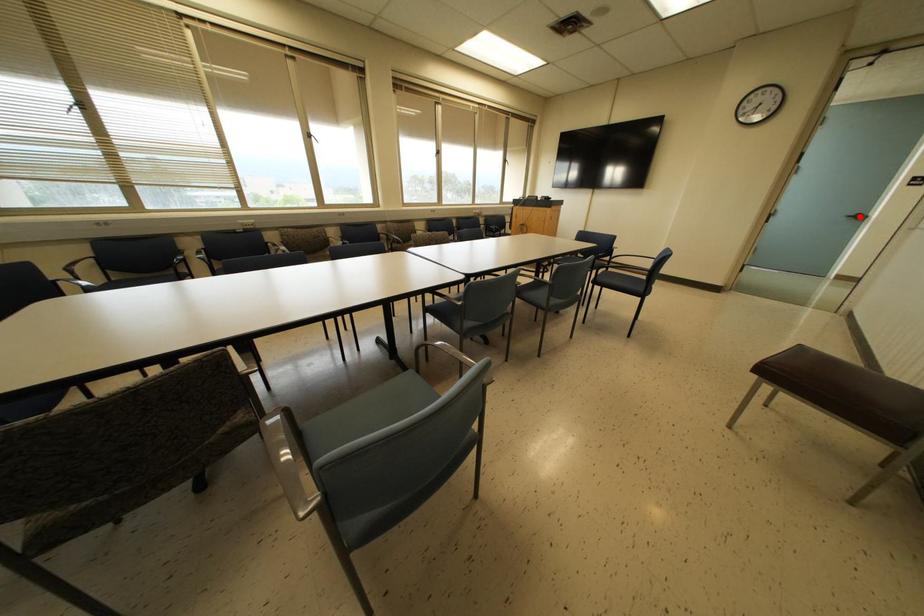
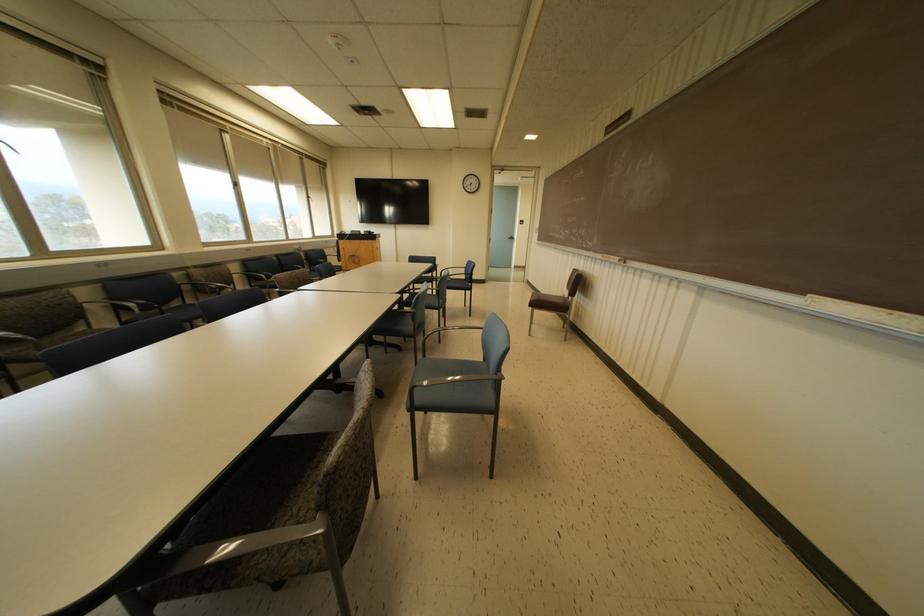
Question: I am providing you with two images of the same scene from different viewpoints. A red point is marked on the first image. Is the red point's position out of view in image 2?

Choices:
 (A) Yes
 (B) No

Answer: (B)